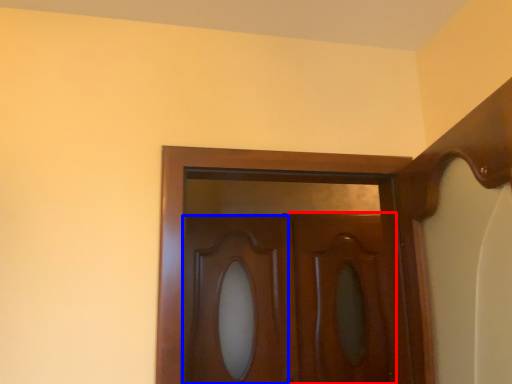
Question: Which of the following is the closest to the observer, screen door (highlighted by a red box) or cabinetry (highlighted by a blue box)?

Choices:
 (A) screen door
 (B) cabinetry

Answer: (B)